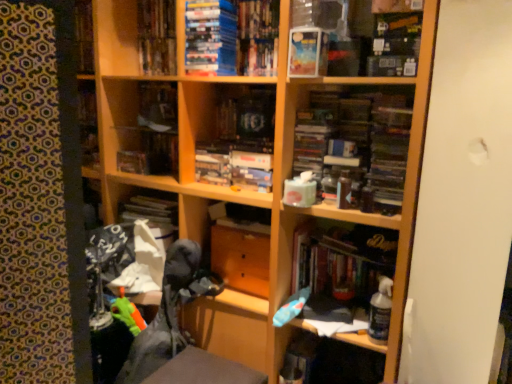
Question: Is hardcover book at center, which appears as the fourth book when viewed from the top, wider or thinner than matte plastic paperback book at upper center?

Choices:
 (A) wide
 (B) thin

Answer: (A)

Question: Is hardcover book at center, which appears as the fourth book when viewed from the top, taller or shorter than matte plastic paperback book at upper center?

Choices:
 (A) short
 (B) tall

Answer: (B)

Question: Which object is the farthest from the matte plastic book at center, acting as the 4th book starting from the right?

Choices:
 (A) matte plastic paperback book at upper center
 (B) hardcover books at upper center, placed as the fourth book when sorted from bottom to top
 (C) matte plastic book at upper center, which ranks as the 2th book in right-to-left order
 (D) wooden drawer at center
 (E) hardcover book at center, which is the first book from right to left

Answer: (E)

Question: Considering the real-world distances, which object is closest to the wooden drawer at center?

Choices:
 (A) matte plastic book at center, acting as the 4th book starting from the right
 (B) matte plastic paperback book at upper center
 (C) hardcover book at center, the fourth book from the left
 (D) hardcover books at upper center, marked as the first book in a top-to-bottom arrangement
 (E) plush gray swivel chair at lower left

Answer: (E)